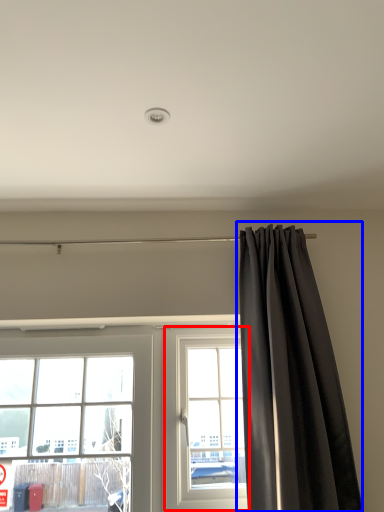
Question: Which point is closer to the camera, window (highlighted by a red box) or curtain (highlighted by a blue box)?

Choices:
 (A) window
 (B) curtain

Answer: (B)